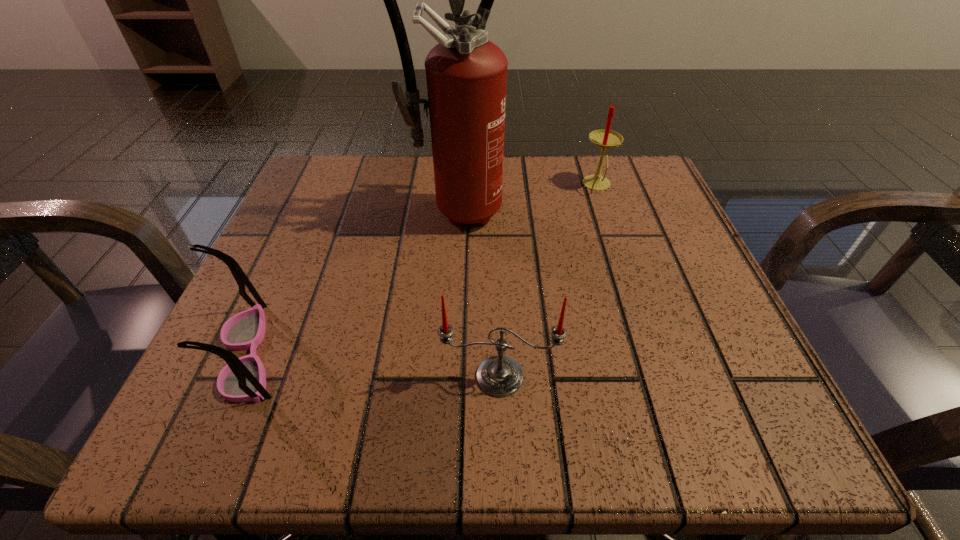
Locate an element on the screen. This screenshot has height=540, width=960. candle present at the near edge is located at coordinates (499, 376).

The height and width of the screenshot is (540, 960). Find the location of `spectacles that is positioned at the near edge`. spectacles that is positioned at the near edge is located at coordinates (243, 379).

This screenshot has height=540, width=960. I want to click on object at the left edge, so click(243, 379).

Identify the location of object that is at the right edge. The image size is (960, 540). (605, 138).

Find the location of `object that is at the near left corner`. object that is at the near left corner is located at coordinates (243, 379).

Locate an element on the screen. object that is positioned at the far right corner is located at coordinates (605, 138).

Locate an element on the screen. This screenshot has width=960, height=540. vacant space at the far edge is located at coordinates (513, 195).

Find the location of `vacant space at the left edge of the desktop`. vacant space at the left edge of the desktop is located at coordinates (273, 346).

Where is `vacant space at the right edge of the desktop`? The height and width of the screenshot is (540, 960). vacant space at the right edge of the desktop is located at coordinates (624, 313).

Locate an element on the screen. The height and width of the screenshot is (540, 960). vacant space at the far left corner of the desktop is located at coordinates (307, 175).